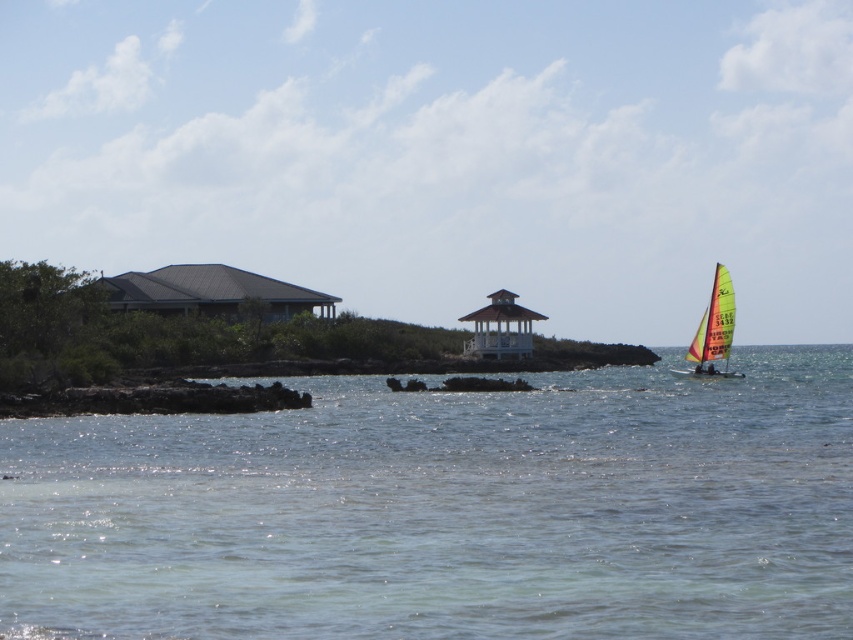
The height and width of the screenshot is (640, 853). Identify the location of gray matte roof at upper left. (212, 292).

Can you confirm if gray matte roof at upper left is wider than yellow-green sailboat at right?

Yes, gray matte roof at upper left is wider than yellow-green sailboat at right.

Find the location of a particular element. gray matte roof at upper left is located at coordinates (212, 292).

You are a GUI agent. You are given a task and a screenshot of the screen. Output one action in this format:
    pyautogui.click(x=<x>, y=<y>)
    Task: Click on the gray matte roof at upper left
    This screenshot has height=640, width=853.
    Given the screenshot: What is the action you would take?
    pyautogui.click(x=212, y=292)

Which is above, clear water at center or gray matte roof at upper left?

gray matte roof at upper left is higher up.

In order to click on clear water at center in this screenshot , I will do `click(447, 512)`.

Find the location of `clear water at center`. clear water at center is located at coordinates (447, 512).

Which of these two, white wooden gazebo at center or yellow-green sailboat at right, stands shorter?

white wooden gazebo at center

Which is above, white wooden gazebo at center or yellow-green sailboat at right?

white wooden gazebo at center is above.

What are the coordinates of `white wooden gazebo at center` in the screenshot? It's located at (500, 326).